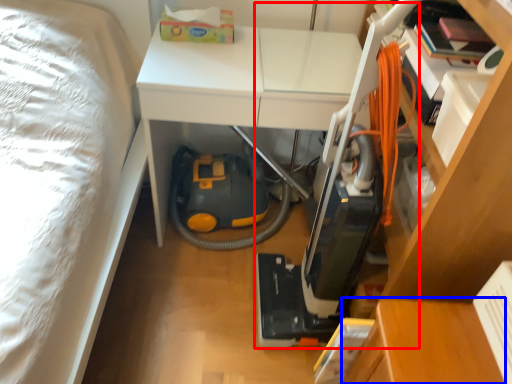
Question: Which object is closer to the camera taking this photo, vacuum (highlighted by a red box) or table (highlighted by a blue box)?

Choices:
 (A) vacuum
 (B) table

Answer: (A)